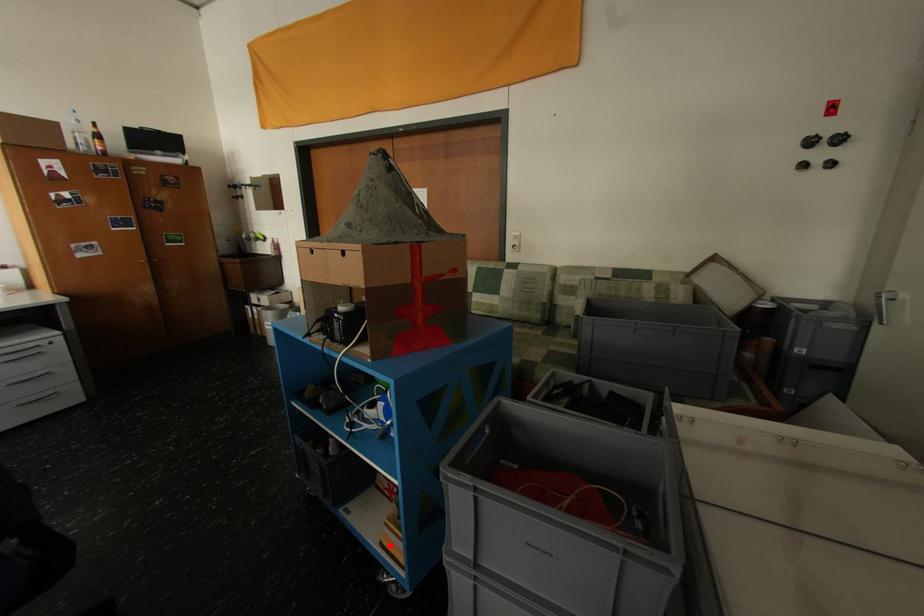
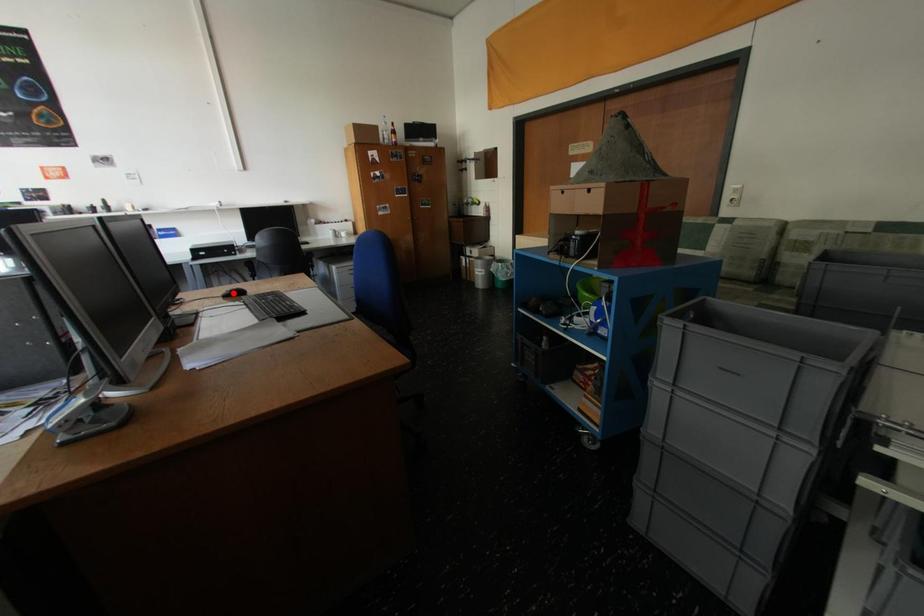
I am providing you with two images of the same scene from different viewpoints. A red point is marked on the first image and another point is marked on the second image. Is the red point in image1 aligned with the point shown in image2?

No